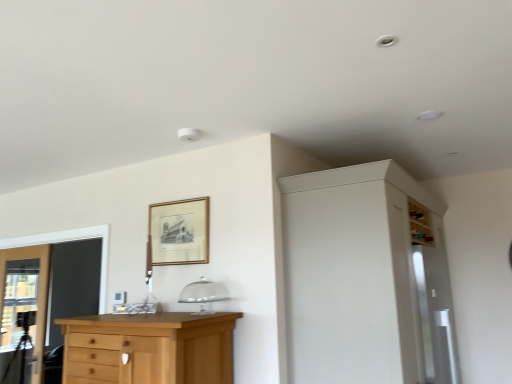
Question: From the image's perspective, is light brown wood chest of drawers at lower left on transparent glass screen door at right?

Choices:
 (A) no
 (B) yes

Answer: (A)

Question: Is light brown wood chest of drawers at lower left smaller than transparent glass screen door at right?

Choices:
 (A) yes
 (B) no

Answer: (A)

Question: From a real-world perspective, is light brown wood chest of drawers at lower left located beneath transparent glass screen door at right?

Choices:
 (A) no
 (B) yes

Answer: (B)

Question: Would you say light brown wood chest of drawers at lower left is outside transparent glass screen door at right?

Choices:
 (A) yes
 (B) no

Answer: (A)

Question: Would you say light brown wood chest of drawers at lower left is a long distance from transparent glass screen door at right?

Choices:
 (A) yes
 (B) no

Answer: (A)

Question: Considering their positions, is white matte cabinet at upper right located in front of or behind transparent glass screen door at right?

Choices:
 (A) front
 (B) behind

Answer: (A)

Question: Is white matte cabinet at upper right wider or thinner than transparent glass screen door at right?

Choices:
 (A) thin
 (B) wide

Answer: (B)

Question: Which is correct: white matte cabinet at upper right is inside transparent glass screen door at right, or outside of it?

Choices:
 (A) inside
 (B) outside

Answer: (B)

Question: Is point (444, 365) closer or farther from the camera than point (432, 316)?

Choices:
 (A) closer
 (B) farther

Answer: (B)

Question: Is point (26, 374) closer or farther from the camera than point (394, 291)?

Choices:
 (A) farther
 (B) closer

Answer: (A)

Question: Considering the relative positions of clear glass door at left and white matte cabinet at upper right in the image provided, is clear glass door at left to the left or to the right of white matte cabinet at upper right?

Choices:
 (A) left
 (B) right

Answer: (A)

Question: From a real-world perspective, is clear glass door at left above or below white matte cabinet at upper right?

Choices:
 (A) below
 (B) above

Answer: (A)

Question: In the image, is clear glass door at left positioned in front of or behind white matte cabinet at upper right?

Choices:
 (A) behind
 (B) front

Answer: (A)

Question: In the image, is clear glass door at left positioned in front of or behind light brown wood chest of drawers at lower left?

Choices:
 (A) front
 (B) behind

Answer: (B)

Question: From the image's perspective, relative to light brown wood chest of drawers at lower left, is clear glass door at left above or below?

Choices:
 (A) below
 (B) above

Answer: (A)